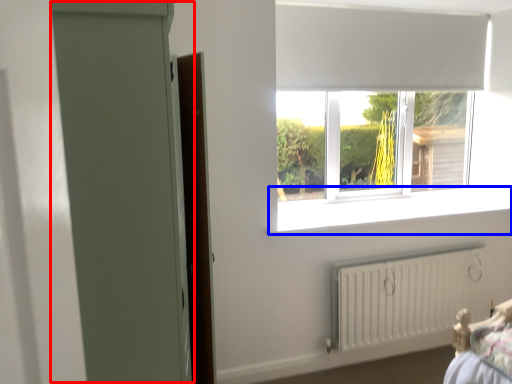
Question: Which object is further to the camera taking this photo, screen door (highlighted by a red box) or window sill (highlighted by a blue box)?

Choices:
 (A) screen door
 (B) window sill

Answer: (B)